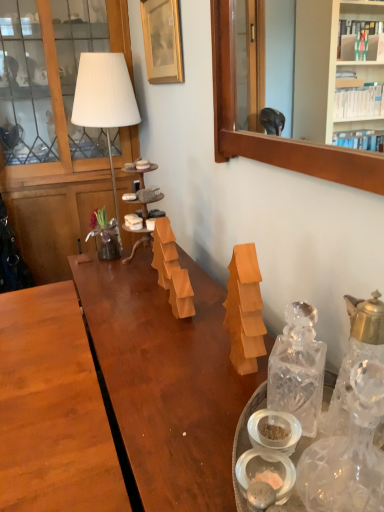
Question: Considering the positions of wooden frame at upper right and clear glass carafe at right, the 2th bottle in the left-to-right sequence, in the image, is wooden frame at upper right taller or shorter than clear glass carafe at right, the 2th bottle in the left-to-right sequence,?

Choices:
 (A) tall
 (B) short

Answer: (A)

Question: Is wooden frame at upper right situated inside clear glass carafe at right, the 2th bottle in the left-to-right sequence, or outside?

Choices:
 (A) inside
 (B) outside

Answer: (B)

Question: Which object is the closest to the wooden tiered tray at center?

Choices:
 (A) clear glass carafe at right, the 2th bottle in the left-to-right sequence
 (B) translucent glass vase at center
 (C) wooden frame at upper right
 (D) transparent glass bottle at right, which is counted as the 2th bottle, starting from the right
 (E) matte wood cabinet at left

Answer: (B)

Question: Which object is the closest to the matte wood cabinet at left?

Choices:
 (A) wooden frame at upper right
 (B) transparent glass bottle at right, which is counted as the 2th bottle, starting from the right
 (C) wooden picture frame at upper center
 (D) wooden tiered tray at center
 (E) translucent glass vase at center

Answer: (C)